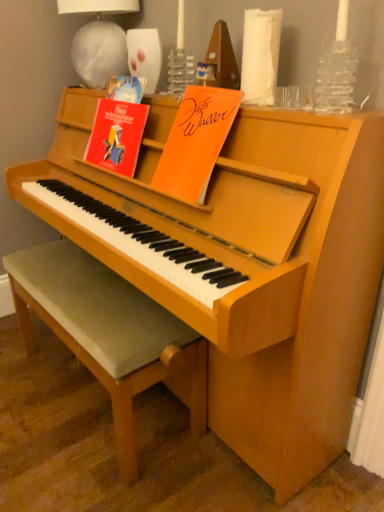
Question: Does light brown wooden stool at center have a smaller size compared to red paper at upper left, which is counted as the 1th paperback book, starting from the left?

Choices:
 (A) yes
 (B) no

Answer: (B)

Question: Is light brown wooden stool at center surrounding red paper at upper left, which is counted as the 1th paperback book, starting from the left?

Choices:
 (A) yes
 (B) no

Answer: (B)

Question: From the image's perspective, is light brown wooden stool at center located beneath red paper at upper left, which is counted as the 1th paperback book, starting from the left?

Choices:
 (A) no
 (B) yes

Answer: (B)

Question: Does light brown wooden stool at center have a lesser width compared to red paper at upper left, which is counted as the second paperback book, starting from the right?

Choices:
 (A) no
 (B) yes

Answer: (A)

Question: Does light brown wooden stool at center have a larger size compared to red paper at upper left, which is counted as the 1th paperback book, starting from the left?

Choices:
 (A) yes
 (B) no

Answer: (A)

Question: Is orange paper at upper center, which is counted as the 2th paperback book, starting from the left, to the left or to the right of light brown wooden stool at center in the image?

Choices:
 (A) right
 (B) left

Answer: (A)

Question: Looking at the image, does orange paper at upper center, which appears as the first paperback book when viewed from the right, seem bigger or smaller compared to light brown wooden stool at center?

Choices:
 (A) small
 (B) big

Answer: (A)

Question: In terms of width, does orange paper at upper center, which appears as the first paperback book when viewed from the right, look wider or thinner when compared to light brown wooden stool at center?

Choices:
 (A) thin
 (B) wide

Answer: (A)

Question: Does point (201, 199) appear closer or farther from the camera than point (94, 369)?

Choices:
 (A) farther
 (B) closer

Answer: (B)

Question: Considering the positions of light brown wooden stool at center and white fabric lampshade at upper center in the image, is light brown wooden stool at center wider or thinner than white fabric lampshade at upper center?

Choices:
 (A) thin
 (B) wide

Answer: (B)

Question: Considering their positions, is light brown wooden stool at center located in front of or behind white fabric lampshade at upper center?

Choices:
 (A) front
 (B) behind

Answer: (A)

Question: From a real-world perspective, is light brown wooden stool at center above or below white fabric lampshade at upper center?

Choices:
 (A) above
 (B) below

Answer: (B)

Question: From the image's perspective, relative to white fabric lampshade at upper center, is light brown wooden stool at center above or below?

Choices:
 (A) below
 (B) above

Answer: (A)

Question: In terms of height, does white fabric lampshade at upper center look taller or shorter compared to red paper at upper left, which is counted as the second paperback book, starting from the right?

Choices:
 (A) tall
 (B) short

Answer: (A)

Question: From a real-world perspective, is white fabric lampshade at upper center physically located above or below red paper at upper left, which is counted as the second paperback book, starting from the right?

Choices:
 (A) below
 (B) above

Answer: (B)